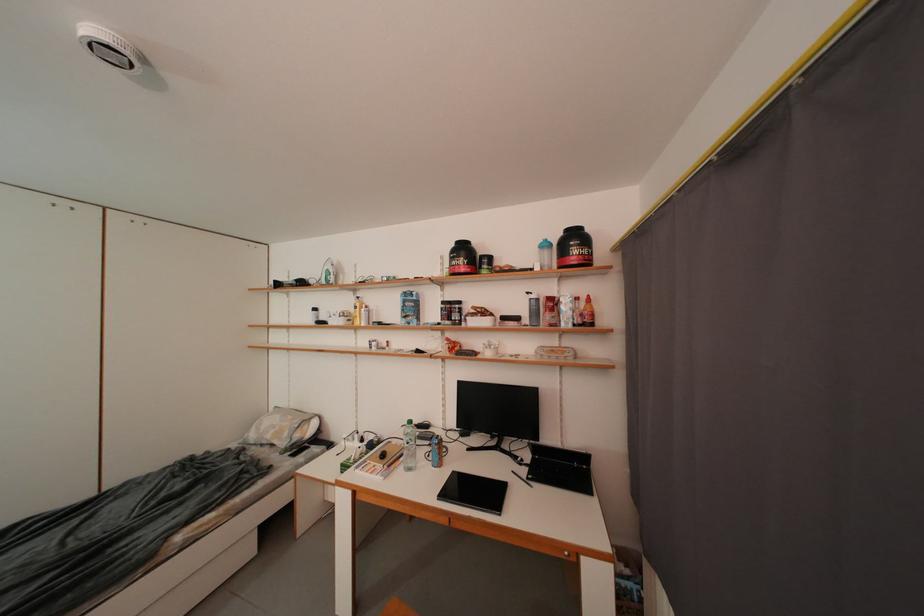
Find the location of a particular element. Image resolution: width=924 pixels, height=616 pixels. white cabinet handle is located at coordinates (569, 556).